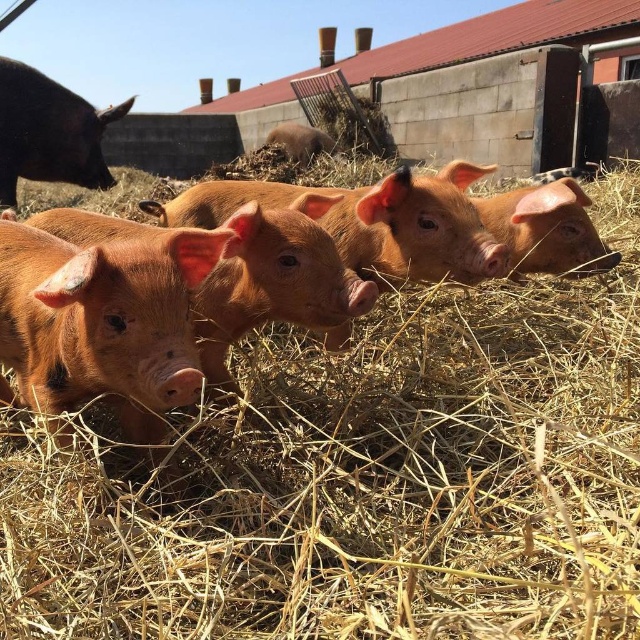
You are a farmer checking on the piglets. You notice the shiny black pig at upper left and the smooth brown piglet at center. Which pig is larger in size?

The shiny black pig at upper left is bigger than the smooth brown piglet at center.

Based on the photo, you are a farmer checking on your pigs. You see the shiny black pig at upper left and the smooth brown piglet at center. Which pig is positioned more to the left side of the image?

The shiny black pig at upper left is positioned more to the left side of the image because it is to the left of the smooth brown piglet at center.

You are a farmer who needs to move a 4 meter long fence panel between the shiny black pig at upper left and the nearest piglet. Is there enough space?

The distance between the shiny black pig at upper left and the nearest piglet is 4.48 meters, which is greater than the 4 meter length of the fence panel. Therefore, there is sufficient space to place the fence panel between them.